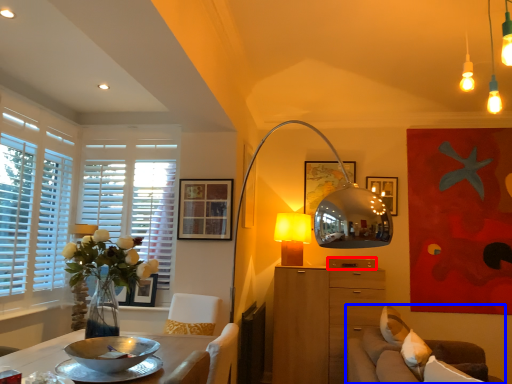
Question: Which point is further to the camera, drawer (highlighted by a red box) or studio couch (highlighted by a blue box)?

Choices:
 (A) drawer
 (B) studio couch

Answer: (A)